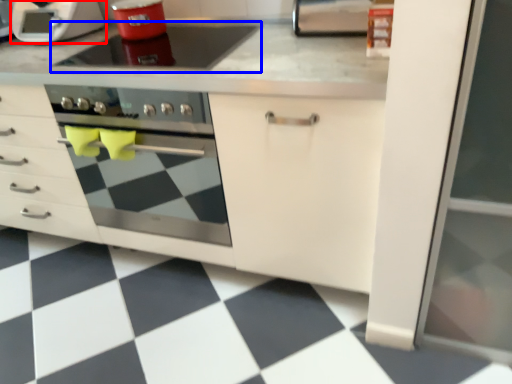
Question: Among these objects, which one is nearest to the camera, home appliance (highlighted by a red box) or gas stove (highlighted by a blue box)?

Choices:
 (A) home appliance
 (B) gas stove

Answer: (B)